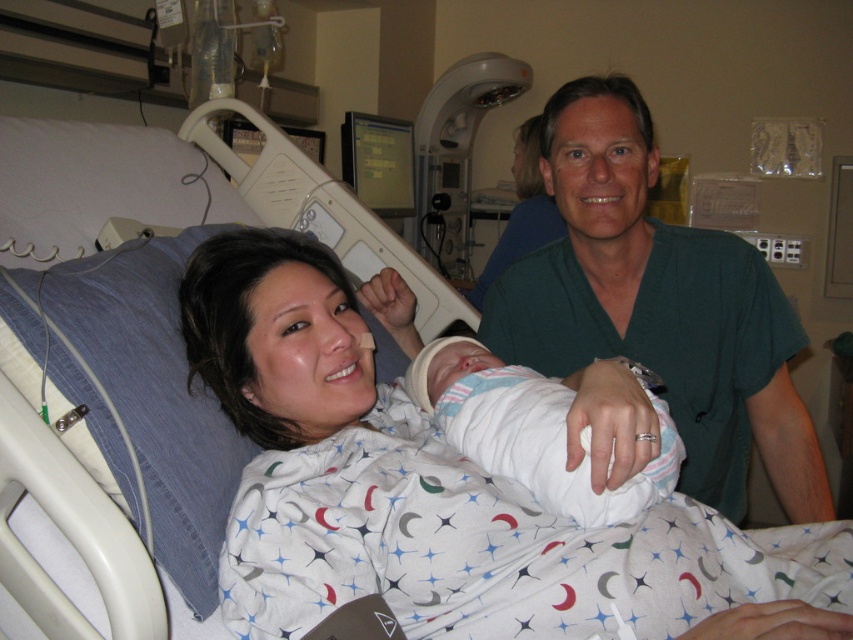
Who is higher up, green scrubs at center or white swaddled newborn at center?

green scrubs at center is above.

Is green scrubs at center above white swaddled newborn at center?

Yes.

The image size is (853, 640). Identify the location of green scrubs at center. (654, 317).